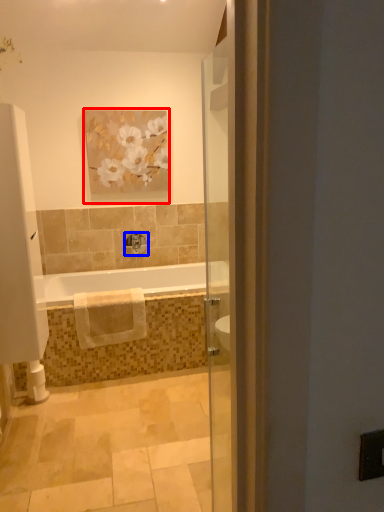
Question: Which object appears farthest to the camera in this image, picture frame (highlighted by a red box) or tap (highlighted by a blue box)?

Choices:
 (A) picture frame
 (B) tap

Answer: (B)